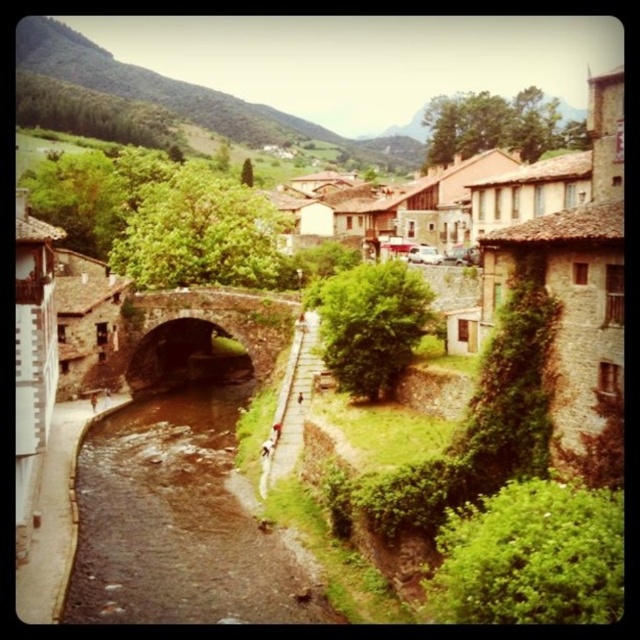
Question: Is brown smooth river at center above dark brown stone bridge at center?

Choices:
 (A) no
 (B) yes

Answer: (A)

Question: Which of the following is the farthest from the observer?

Choices:
 (A) (86, 477)
 (B) (262, 308)

Answer: (B)

Question: Is brown smooth river at center to the left of dark brown stone bridge at center from the viewer's perspective?

Choices:
 (A) yes
 (B) no

Answer: (B)

Question: Is brown smooth river at center positioned in front of dark brown stone bridge at center?

Choices:
 (A) yes
 (B) no

Answer: (A)